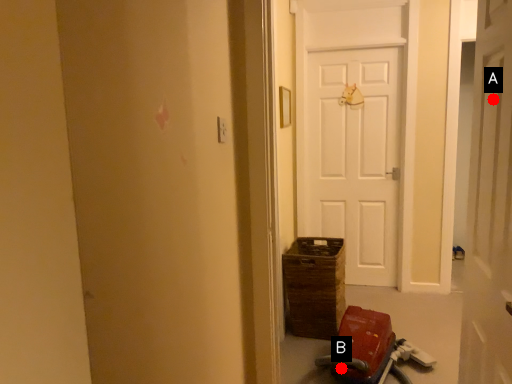
Question: Two points are circled on the image, labeled by A and B beside each circle. Which point appears closest to the camera in this image?

Choices:
 (A) A is closer
 (B) B is closer

Answer: (A)